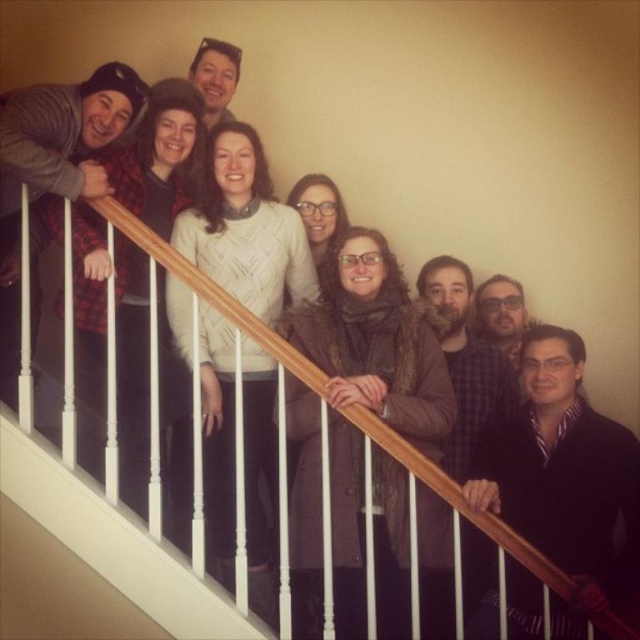
Does wooden handrail at center have a greater width compared to white knitted sweater at center?

Yes.

Between point (474, 512) and point (269, 365), which one is positioned behind?

The point (269, 365) is behind.

Find the location of a particular element. The image size is (640, 640). wooden handrail at center is located at coordinates (131, 532).

Is brown fuzzy coat at center shorter than white knitted sweater at center?

No, brown fuzzy coat at center is not shorter than white knitted sweater at center.

Looking at this image, does brown fuzzy coat at center appear under white knitted sweater at center?

Indeed, brown fuzzy coat at center is positioned under white knitted sweater at center.

You are a GUI agent. You are given a task and a screenshot of the screen. Output one action in this format:
    pyautogui.click(x=<x>, y=<y>)
    Task: Click on the brown fuzzy coat at center
    This screenshot has height=640, width=640.
    Given the screenshot: What is the action you would take?
    pyautogui.click(x=376, y=342)

From the picture: Can you confirm if brown fuzzy coat at center is smaller than wooden handrail at center?

No, brown fuzzy coat at center is not smaller than wooden handrail at center.

Describe the element at coordinates (376, 342) in the screenshot. The image size is (640, 640). I see `brown fuzzy coat at center` at that location.

The image size is (640, 640). What are the coordinates of `brown fuzzy coat at center` in the screenshot? It's located at (376, 342).

The width and height of the screenshot is (640, 640). What are the coordinates of `brown fuzzy coat at center` in the screenshot? It's located at (376, 342).